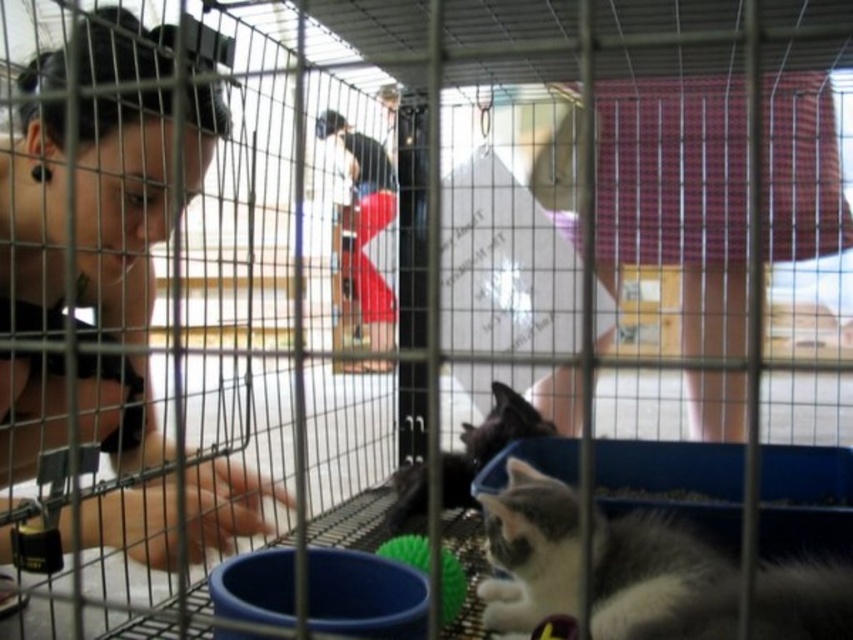
Who is positioned more to the right, matte black hair at left or gray and white fur cat at lower right?

Positioned to the right is gray and white fur cat at lower right.

Can you confirm if matte black hair at left is positioned to the left of gray and white fur cat at lower right?

Yes, matte black hair at left is to the left of gray and white fur cat at lower right.

Is point (83, 522) in front of point (648, 593)?

No, (83, 522) is further to viewer.

Locate an element on the screen. matte black hair at left is located at coordinates (94, 234).

Who is more forward, (572,545) or (422,465)?

Point (572,545)

Between gray and white fur cat at lower right and black fur cat at lower center, which one has less height?

Standing shorter between the two is gray and white fur cat at lower right.

Image resolution: width=853 pixels, height=640 pixels. Identify the location of gray and white fur cat at lower right. (656, 579).

Does matte black hair at left appear on the left side of black fur cat at lower center?

Yes, matte black hair at left is to the left of black fur cat at lower center.

Does matte black hair at left lie in front of black fur cat at lower center?

Yes, it is in front of black fur cat at lower center.

This screenshot has height=640, width=853. Describe the element at coordinates (94, 234) in the screenshot. I see `matte black hair at left` at that location.

Find the location of a particular element. matte black hair at left is located at coordinates (94, 234).